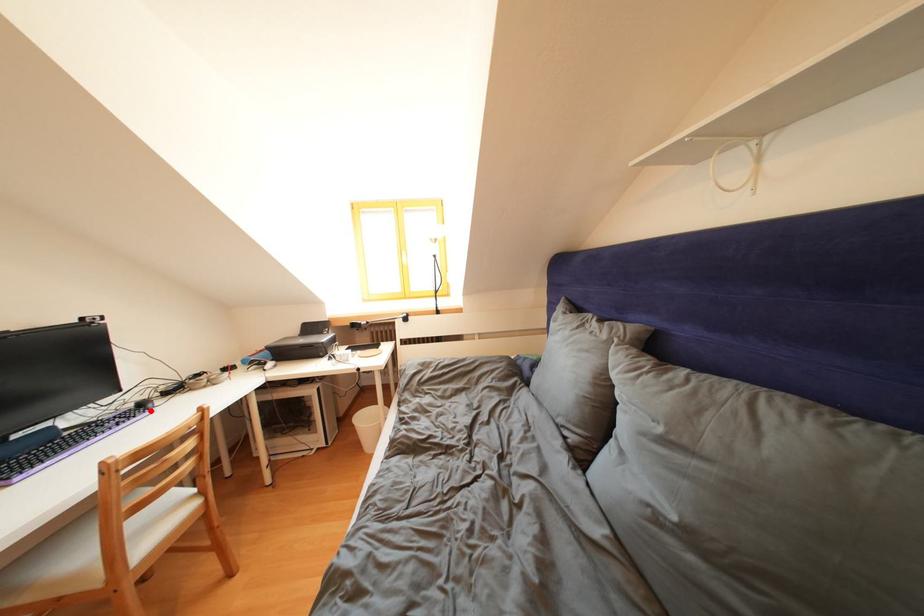
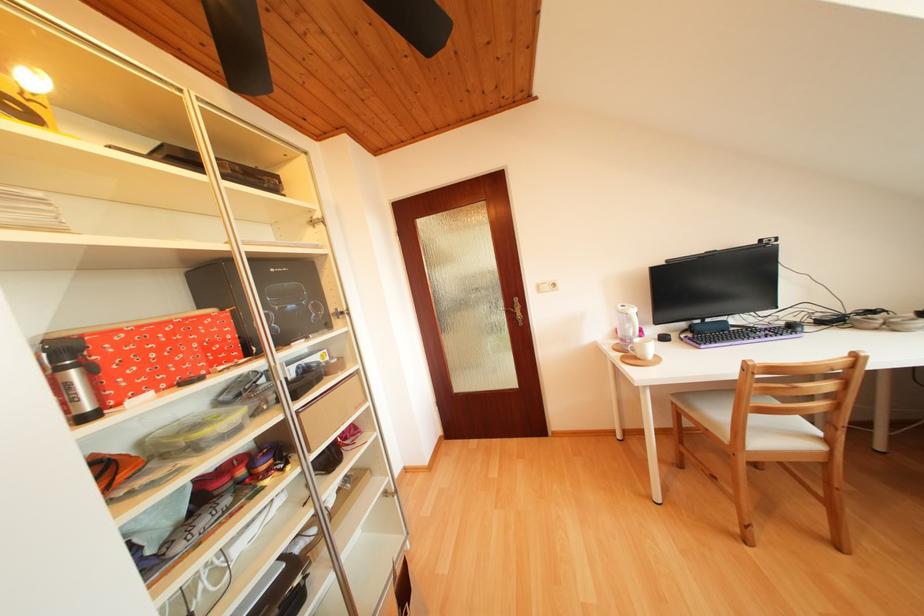
Find the pixel in the second image that matches the highlighted location in the first image.

(799, 331)